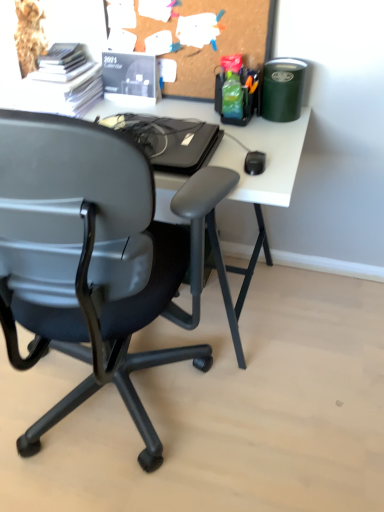
Question: Do you think corkboard at upper center is within white matte computer desk at upper center, or outside of it?

Choices:
 (A) outside
 (B) inside

Answer: (A)

Question: Is corkboard at upper center in front of or behind white matte computer desk at upper center in the image?

Choices:
 (A) front
 (B) behind

Answer: (B)

Question: Which object is positioned farthest from the translucent plastic organizer at upper right, the 3th stationery from the left?

Choices:
 (A) corkboard at upper center
 (B) matte black calendar at upper center, the second stationery in the left-to-right sequence
 (C) white matte computer desk at upper center
 (D) green matte trash can at upper right, which ranks as the 1th stationery in right-to-left order
 (E) white paper stack at upper left, which appears as the fourth stationery when viewed from the right

Answer: (E)

Question: Estimate the real-world distances between objects in this image. Which object is farther from the green matte trash can at upper right, which ranks as the 1th stationery in right-to-left order?

Choices:
 (A) corkboard at upper center
 (B) translucent plastic organizer at upper right, the 3th stationery from the left
 (C) white paper stack at upper left, which appears as the fourth stationery when viewed from the right
 (D) white matte computer desk at upper center
 (E) matte black calendar at upper center, the second stationery in the left-to-right sequence

Answer: (C)